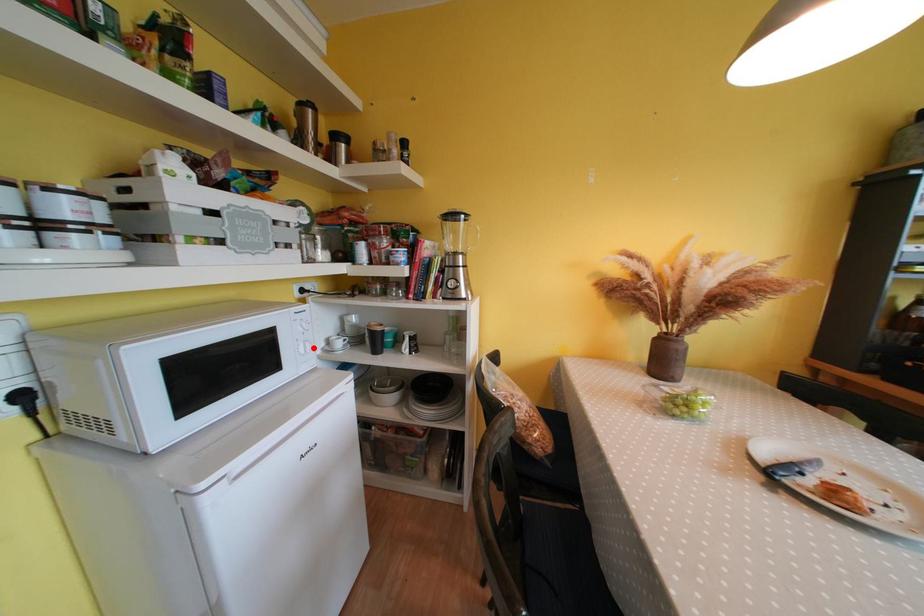
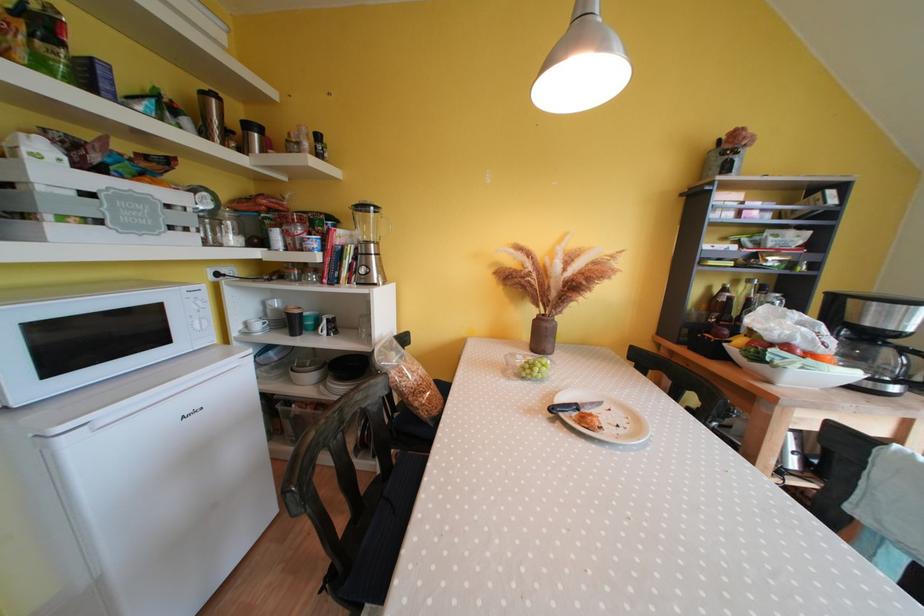
Question: I am providing you with two images of the same scene from different viewpoints. A red point is marked on the first image. Can you still see the location of the red point in image 2?

Choices:
 (A) Yes
 (B) No

Answer: (A)